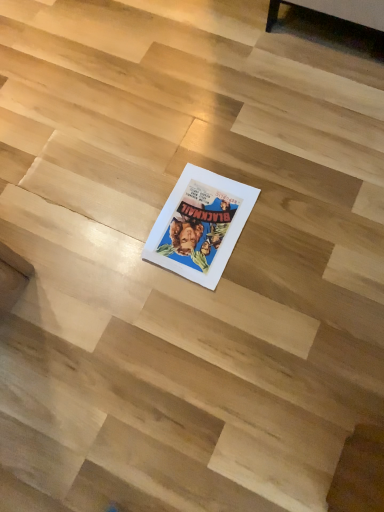
Image resolution: width=384 pixels, height=512 pixels. What are the coordinates of `free space to the right of white paper book at center` in the screenshot? It's located at (289, 219).